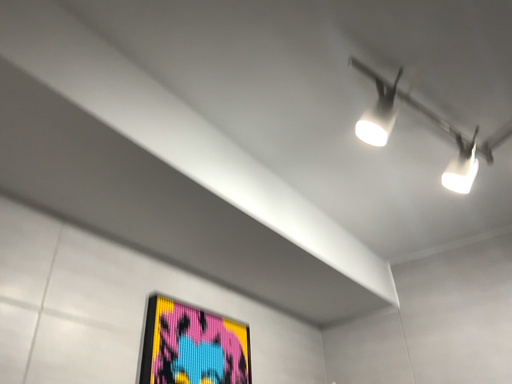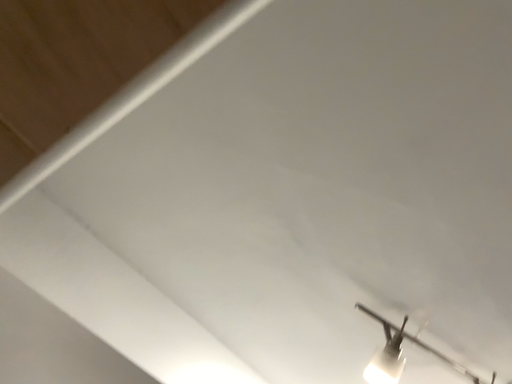
Question: How did the camera likely rotate when shooting the video?

Choices:
 (A) rotated upward
 (B) rotated downward

Answer: (A)